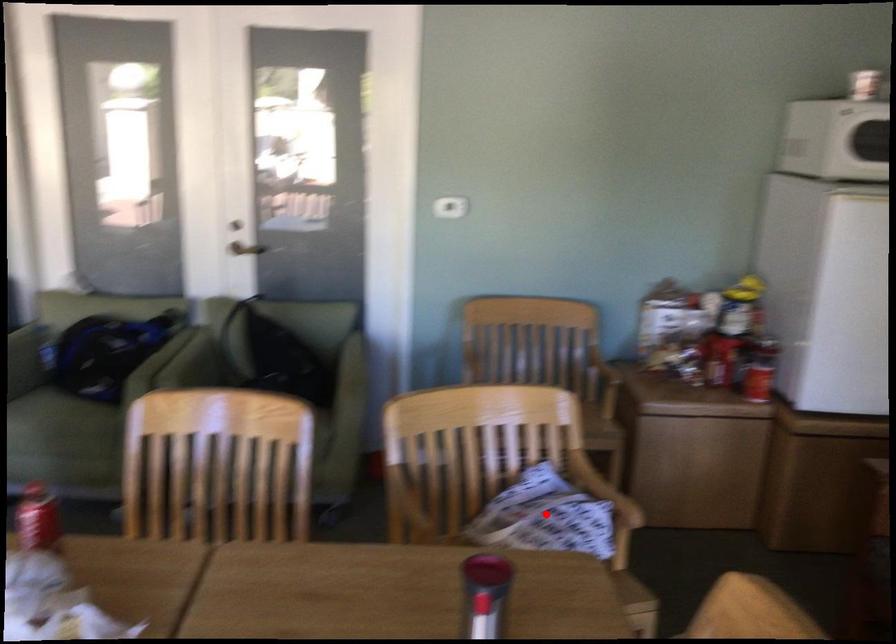
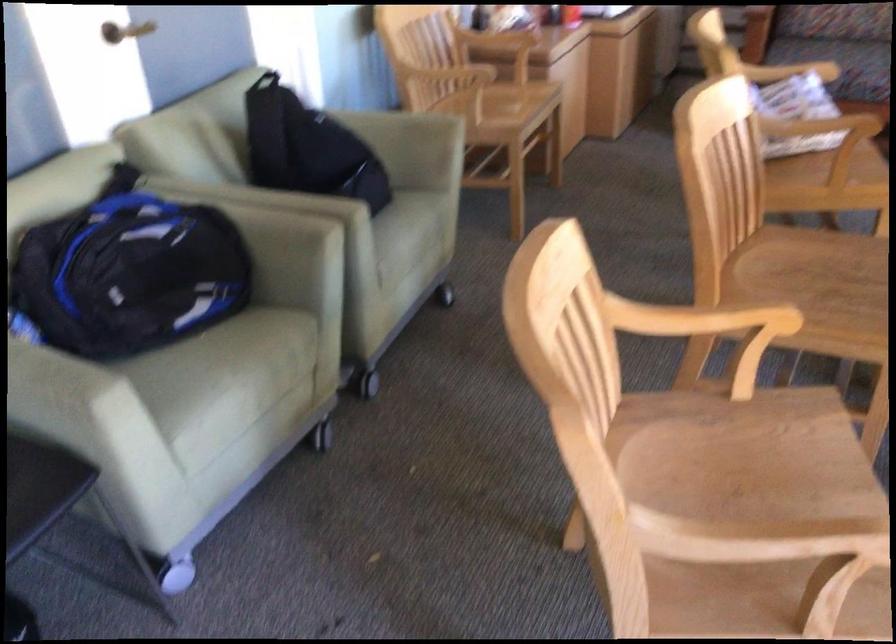
In the second image, find the point that corresponds to the highlighted location in the first image.

(790, 71)